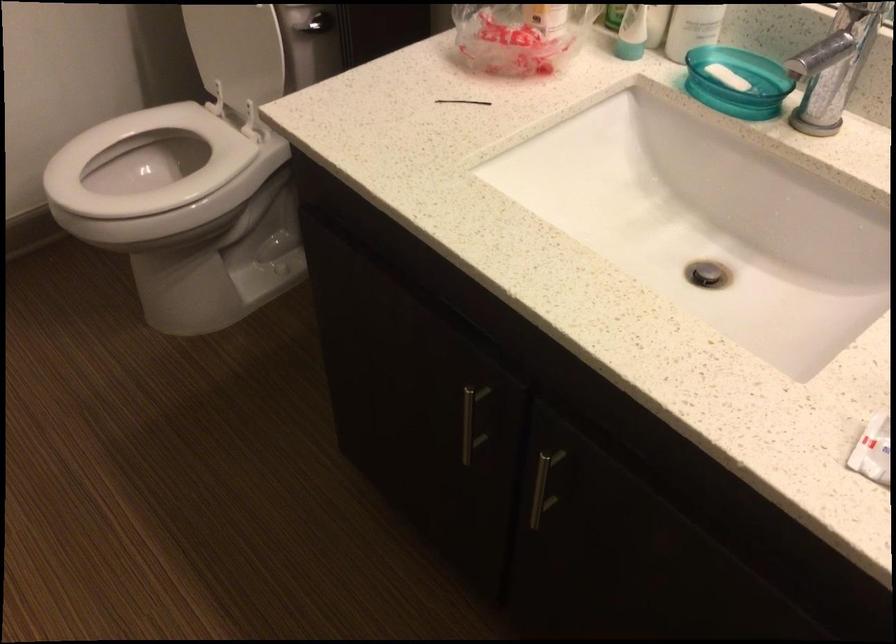
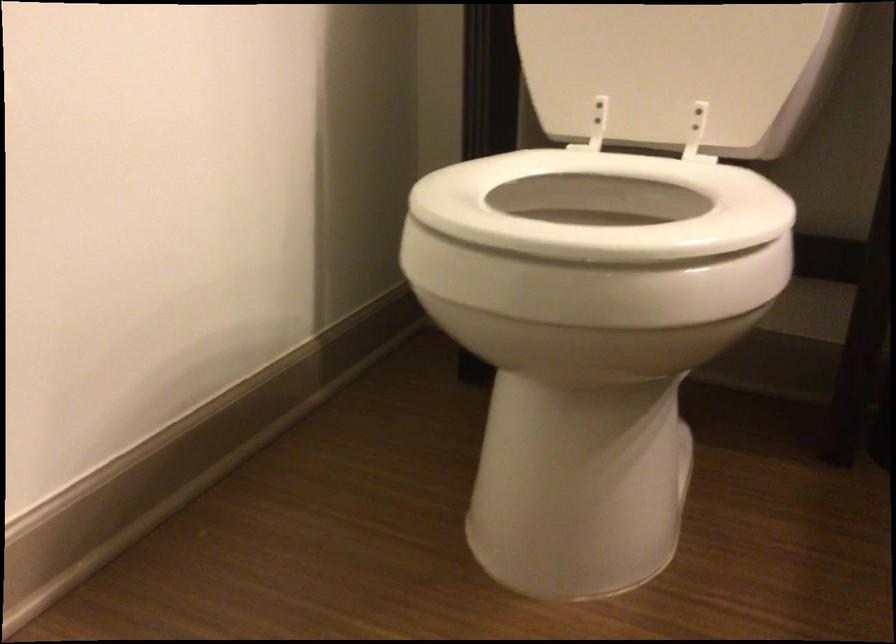
Find the pixel in the second image that matches point (211, 140) in the first image.

(602, 205)